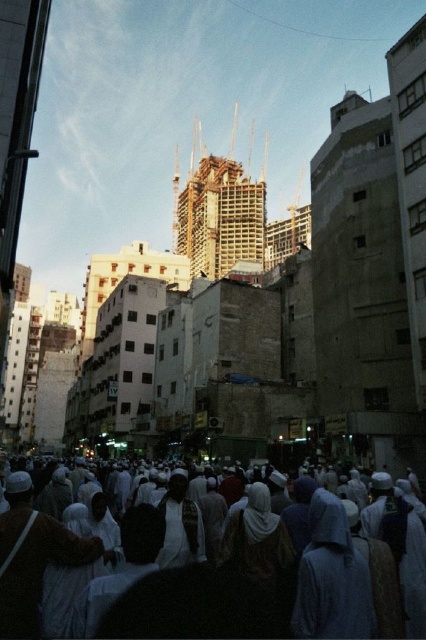
From the picture: Is light brown fabric robe at lower left above white matte robe at center?

Indeed, light brown fabric robe at lower left is positioned over white matte robe at center.

Is light brown fabric robe at lower left bigger than white matte robe at center?

Yes, light brown fabric robe at lower left is bigger than white matte robe at center.

This screenshot has width=426, height=640. Find the location of `light brown fabric robe at lower left`. light brown fabric robe at lower left is located at coordinates (32, 563).

Locate an element on the screen. The width and height of the screenshot is (426, 640). light brown fabric robe at lower left is located at coordinates 32,563.

Which of these two, white clothed crowd at center or light brown fabric robe at lower left, stands shorter?

light brown fabric robe at lower left

Who is more forward, (x=296, y=588) or (x=32, y=538)?

Point (x=32, y=538) is in front.

Is point (115, 634) closer to camera compared to point (40, 522)?

Yes.

What are the coordinates of `white clothed crowd at center` in the screenshot? It's located at (186, 605).

Who is shorter, white clothed crowd at center or white matte robe at center?

With less height is white matte robe at center.

Which is below, white clothed crowd at center or white matte robe at center?

white matte robe at center is below.

Is point (365, 634) farther from camera compared to point (195, 522)?

That is False.

You are a GUI agent. You are given a task and a screenshot of the screen. Output one action in this format:
    pyautogui.click(x=<x>, y=<y>)
    Task: Click on the white clothed crowd at center
    
    Given the screenshot: What is the action you would take?
    pyautogui.click(x=186, y=605)